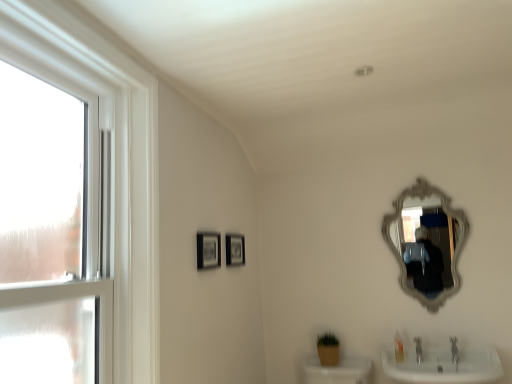
Find the location of `clear glass window at left`. clear glass window at left is located at coordinates (110, 162).

You are a GUI agent. You are given a task and a screenshot of the screen. Output one action in this format:
    pyautogui.click(x=<x>, y=<y>)
    Task: Click on the translucent plastic soap at lower right
    The image size is (512, 384).
    Given the screenshot: What is the action you would take?
    pyautogui.click(x=398, y=347)

From the image's perspective, would you say clear glass window at left is positioned over silver/gilded ornate mirror at upper right?

Yes.

Would you say clear glass window at left is to the left or to the right of silver/gilded ornate mirror at upper right in the picture?

→ From the image, it's evident that clear glass window at left is to the left of silver/gilded ornate mirror at upper right.

Which point is more forward, [99,139] or [412,205]?

The point [99,139] is in front.

In the image, is matte black picture frame at center, the 2th picture frame viewed from the left, on the left side or the right side of matte black picture frame at center, which ranks as the 2th picture frame in right-to-left order?

From the image, it's evident that matte black picture frame at center, the 2th picture frame viewed from the left, is to the right of matte black picture frame at center, which ranks as the 2th picture frame in right-to-left order.

Which of these two, matte black picture frame at center, arranged as the 1th picture frame when viewed from the back, or matte black picture frame at center, which ranks as the 2th picture frame in right-to-left order, is bigger?

With larger size is matte black picture frame at center, which ranks as the 2th picture frame in right-to-left order.

In the scene shown: Which is closer to the camera, (237, 262) or (209, 241)?

The point (209, 241) is closer.

Between matte black picture frame at center, the 2th picture frame viewed from the left, and matte black picture frame at center, the first picture frame viewed from the front, which one has more height?

matte black picture frame at center, the first picture frame viewed from the front, is taller.

Who is taller, clear glass window at left or matte black picture frame at center, which ranks as the first picture frame in left-to-right order?

clear glass window at left.

Is clear glass window at left looking in the opposite direction of matte black picture frame at center, which ranks as the first picture frame in left-to-right order?

No, clear glass window at left's orientation is not away from matte black picture frame at center, which ranks as the first picture frame in left-to-right order.

Is there a large distance between clear glass window at left and matte black picture frame at center, which ranks as the first picture frame in left-to-right order?

They are positioned close to each other.

Between translucent plastic soap at lower right and matte black picture frame at center, which ranks as the first picture frame in left-to-right order, which one has more height?

matte black picture frame at center, which ranks as the first picture frame in left-to-right order, is taller.

Which is farther, [396,335] or [217,261]?

The point [396,335] is behind.

Is matte black picture frame at center, which ranks as the 2th picture frame in right-to-left order, completely or partially inside translucent plastic soap at lower right?

No, translucent plastic soap at lower right does not contain matte black picture frame at center, which ranks as the 2th picture frame in right-to-left order.

Based on the photo, is translucent plastic soap at lower right oriented towards matte black picture frame at center, which ranks as the 2th picture frame in right-to-left order?

No, translucent plastic soap at lower right is not aimed at matte black picture frame at center, which ranks as the 2th picture frame in right-to-left order.

Are matte black picture frame at center, which ranks as the first picture frame in left-to-right order, and clear glass window at left far apart?

No, matte black picture frame at center, which ranks as the first picture frame in left-to-right order, is not far away from clear glass window at left.

Looking at this image, is matte black picture frame at center, which ranks as the first picture frame in left-to-right order, inside or outside of clear glass window at left?

matte black picture frame at center, which ranks as the first picture frame in left-to-right order, lies outside clear glass window at left.

Is matte black picture frame at center, the first picture frame viewed from the front, wider than clear glass window at left?

→ Incorrect, the width of matte black picture frame at center, the first picture frame viewed from the front, does not surpass that of clear glass window at left.

Consider the image. From the image's perspective, between silver/gilded ornate mirror at upper right and matte black picture frame at center, arranged as the 1th picture frame when viewed from the back, which one is located above?

From the image's view, silver/gilded ornate mirror at upper right is above.

Is matte black picture frame at center, the 2th picture frame viewed from the left, surrounded by silver/gilded ornate mirror at upper right?

No, matte black picture frame at center, the 2th picture frame viewed from the left, is not a part of silver/gilded ornate mirror at upper right.

From a real-world perspective, is silver/gilded ornate mirror at upper right beneath matte black picture frame at center, which ranks as the 2th picture frame in front-to-back order?

Yes.

This screenshot has height=384, width=512. I want to click on mirror below the matte black picture frame at center, which ranks as the 2th picture frame in front-to-back order (from a real-world perspective), so click(x=430, y=235).

From a real-world perspective, is matte black picture frame at center, arranged as the 1th picture frame when viewed from the back, positioned above or below translucent plastic soap at lower right?

matte black picture frame at center, arranged as the 1th picture frame when viewed from the back, is situated higher than translucent plastic soap at lower right in the real world.

Are matte black picture frame at center, the 2th picture frame viewed from the left, and translucent plastic soap at lower right beside each other?

No, matte black picture frame at center, the 2th picture frame viewed from the left, is not beside translucent plastic soap at lower right.

Does matte black picture frame at center, the 2th picture frame viewed from the left, have a lesser width compared to translucent plastic soap at lower right?

Yes, matte black picture frame at center, the 2th picture frame viewed from the left, is thinner than translucent plastic soap at lower right.

Image resolution: width=512 pixels, height=384 pixels. I want to click on window in front of the silver/gilded ornate mirror at upper right, so click(x=110, y=162).

Where is `picture frame lying on the left of matte black picture frame at center, which ranks as the 2th picture frame in front-to-back order`? This screenshot has width=512, height=384. picture frame lying on the left of matte black picture frame at center, which ranks as the 2th picture frame in front-to-back order is located at coordinates (208, 250).

From the image, which object appears to be farther from translucent plastic soap at lower right, silver/gilded ornate mirror at upper right or matte black picture frame at center, the 1th picture frame when ordered from right to left?

The object further to translucent plastic soap at lower right is matte black picture frame at center, the 1th picture frame when ordered from right to left.

Based on their spatial positions, is matte black picture frame at center, the first picture frame viewed from the front, or silver/gilded ornate mirror at upper right further from clear glass window at left?

Among the two, silver/gilded ornate mirror at upper right is located further to clear glass window at left.

Looking at the image, which one is located closer to translucent plastic soap at lower right, clear glass window at left or matte black picture frame at center, the 1th picture frame when ordered from right to left?

Based on the image, matte black picture frame at center, the 1th picture frame when ordered from right to left, appears to be nearer to translucent plastic soap at lower right.

Which object lies further to the anchor point matte black picture frame at center, the 1th picture frame when ordered from right to left, matte black picture frame at center, placed as the 2th picture frame when sorted from back to front, or silver/gilded ornate mirror at upper right?

silver/gilded ornate mirror at upper right.

Which object lies nearer to the anchor point matte black picture frame at center, which ranks as the 2th picture frame in front-to-back order, translucent plastic soap at lower right or clear glass window at left?

clear glass window at left is closer to matte black picture frame at center, which ranks as the 2th picture frame in front-to-back order.

When comparing their distances from matte black picture frame at center, the 2th picture frame viewed from the left, does silver/gilded ornate mirror at upper right or translucent plastic soap at lower right seem further?

silver/gilded ornate mirror at upper right is further to matte black picture frame at center, the 2th picture frame viewed from the left.

From the picture: From the image, which object appears to be farther from matte black picture frame at center, arranged as the 1th picture frame when viewed from the back, clear glass window at left or translucent plastic soap at lower right?

translucent plastic soap at lower right.

Looking at the image, which one is located further to matte black picture frame at center, the first picture frame viewed from the front, clear glass window at left or translucent plastic soap at lower right?

Among the two, translucent plastic soap at lower right is located further to matte black picture frame at center, the first picture frame viewed from the front.

Image resolution: width=512 pixels, height=384 pixels. What are the coordinates of `picture frame located between clear glass window at left and matte black picture frame at center, which ranks as the 2th picture frame in front-to-back order, in the depth direction` in the screenshot? It's located at (208, 250).

Locate an element on the screen. Image resolution: width=512 pixels, height=384 pixels. picture frame between matte black picture frame at center, placed as the 2th picture frame when sorted from back to front, and silver/gilded ornate mirror at upper right from left to right is located at coordinates (234, 249).

This screenshot has width=512, height=384. Identify the location of toiletry located between matte black picture frame at center, the first picture frame viewed from the front, and silver/gilded ornate mirror at upper right in the left-right direction. (398, 347).

Locate an element on the screen. The image size is (512, 384). toiletry situated between matte black picture frame at center, which ranks as the 2th picture frame in front-to-back order, and silver/gilded ornate mirror at upper right from left to right is located at coordinates (398, 347).